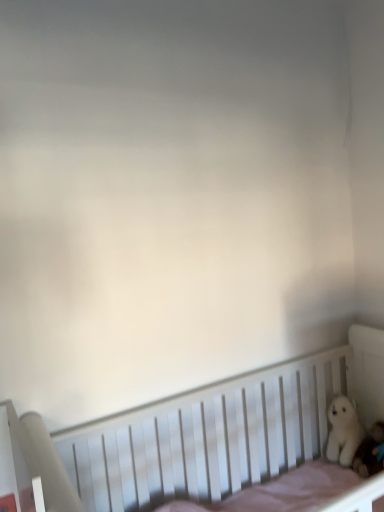
Question: From the image's perspective, is white plush toy at lower right, marked as the first toy in a front-to-back arrangement, positioned above or below white plush bear at right, positioned as the first toy in back-to-front order?

Choices:
 (A) above
 (B) below

Answer: (B)

Question: Based on their positions, is white plush toy at lower right, acting as the second toy starting from the back, located to the left or right of white plush bear at right, positioned as the first toy in back-to-front order?

Choices:
 (A) left
 (B) right

Answer: (B)

Question: Considering the real-world distances, which object is closest to the white wooden crib at lower right?

Choices:
 (A) white plush bear at right, positioned as the first toy in back-to-front order
 (B) white plush toy at lower right, marked as the first toy in a front-to-back arrangement

Answer: (A)

Question: Which object is the farthest from the white plush toy at lower right, marked as the first toy in a front-to-back arrangement?

Choices:
 (A) white plush bear at right, positioned as the first toy in back-to-front order
 (B) white wooden crib at lower right

Answer: (B)